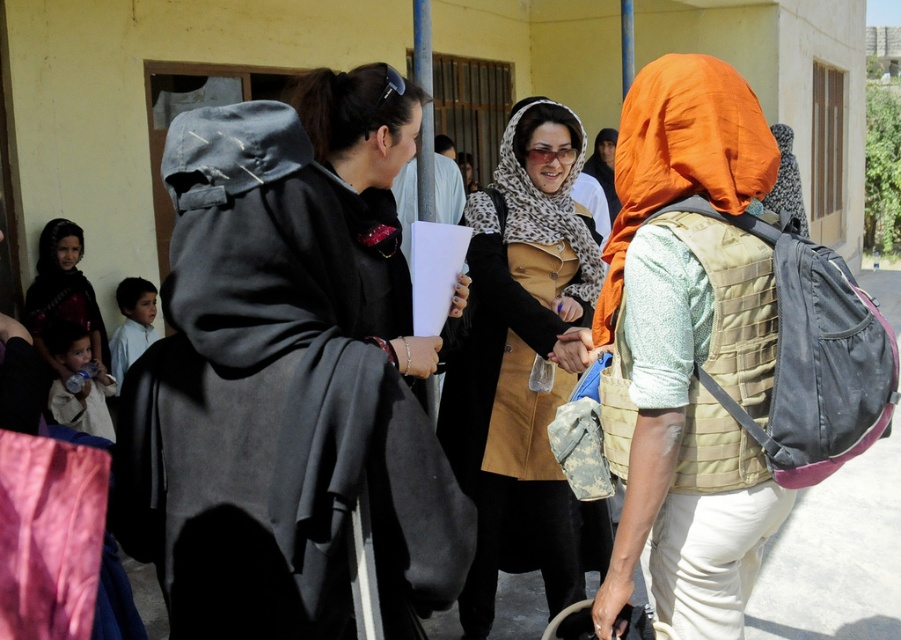
Question: Considering the real-world distances, which object is farthest from the leopard print fabric at center?

Choices:
 (A) orange fabric headscarf at center
 (B) dark gray woolen robe at center

Answer: (B)

Question: Where is dark gray woolen robe at center located in relation to leopard print fabric at center in the image?

Choices:
 (A) right
 (B) left

Answer: (B)

Question: Which object is positioned farthest from the matte black dress at lower left?

Choices:
 (A) orange fabric headscarf at center
 (B) leopard print fabric at center
 (C) dark gray woolen robe at center

Answer: (A)

Question: Does dark gray woolen robe at center have a greater width compared to orange fabric headscarf at center?

Choices:
 (A) no
 (B) yes

Answer: (B)

Question: Which is nearer to the matte black dress at lower left?

Choices:
 (A) dark gray woolen robe at center
 (B) leopard print fabric at center
 (C) orange fabric headscarf at center

Answer: (B)

Question: Can you confirm if dark gray woolen robe at center is positioned to the left of leopard print fabric at center?

Choices:
 (A) no
 (B) yes

Answer: (B)